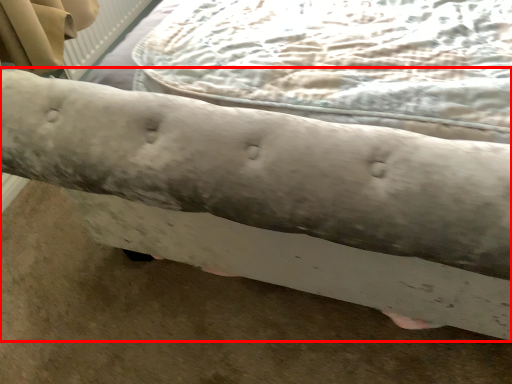
Question: From the image's perspective, what is the correct spatial positioning of furniture (annotated by the red box) in reference to sheet?

Choices:
 (A) above
 (B) below

Answer: (A)